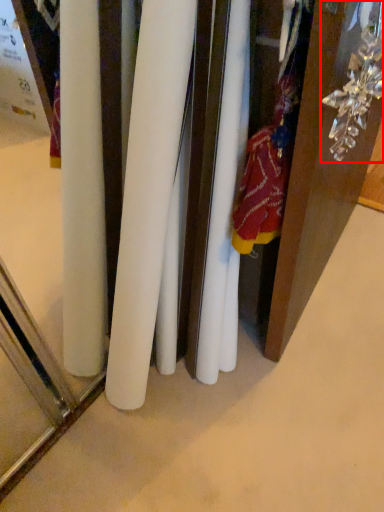
Question: From the image's perspective, considering the relative positions of accessory (annotated by the red box) and surface in the image provided, where is accessory (annotated by the red box) located with respect to the staircase?

Choices:
 (A) above
 (B) below

Answer: (A)